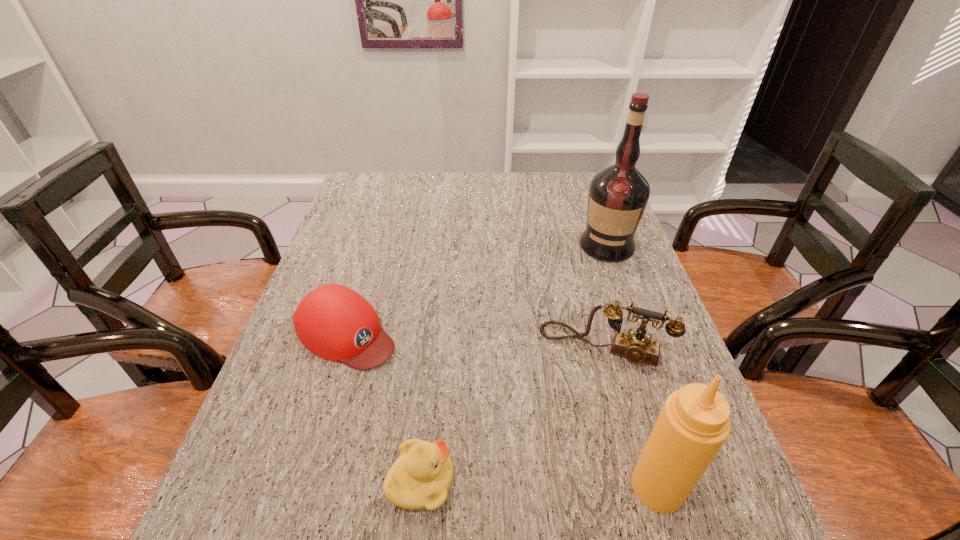
Where is `vacant space on the desktop that is between the fourth object from right to left and the second tallest object and is positioned on the front-facing side of the telephone`? vacant space on the desktop that is between the fourth object from right to left and the second tallest object and is positioned on the front-facing side of the telephone is located at coordinates (571, 484).

Where is `free space on the desktop that is between the duckling and the condiment and is positioned on the surface of the farthest object`? The height and width of the screenshot is (540, 960). free space on the desktop that is between the duckling and the condiment and is positioned on the surface of the farthest object is located at coordinates (524, 484).

Identify the location of vacant spot on the desktop that is between the fourth object from right to left and the condiment and is positioned on the front-facing side of the leftmost object. The image size is (960, 540). (558, 484).